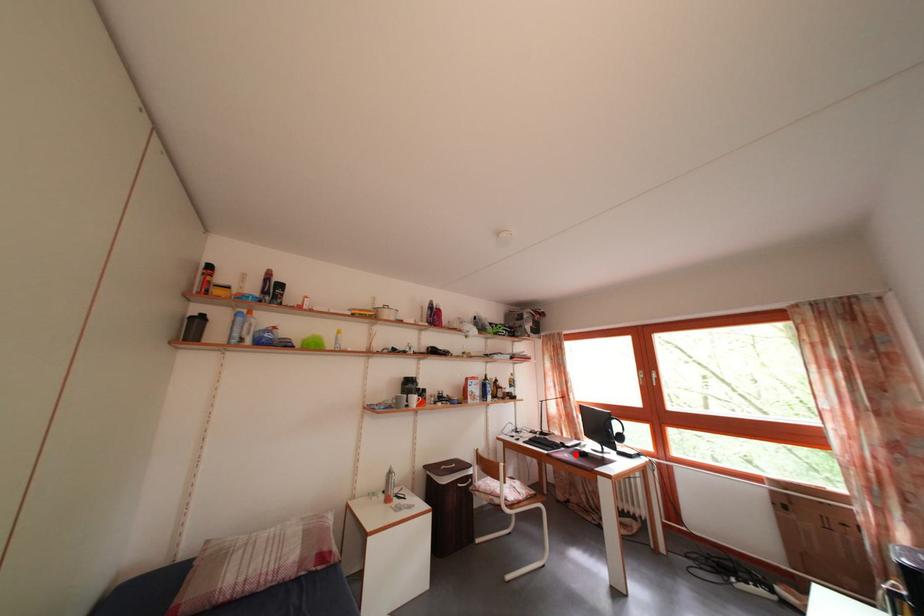
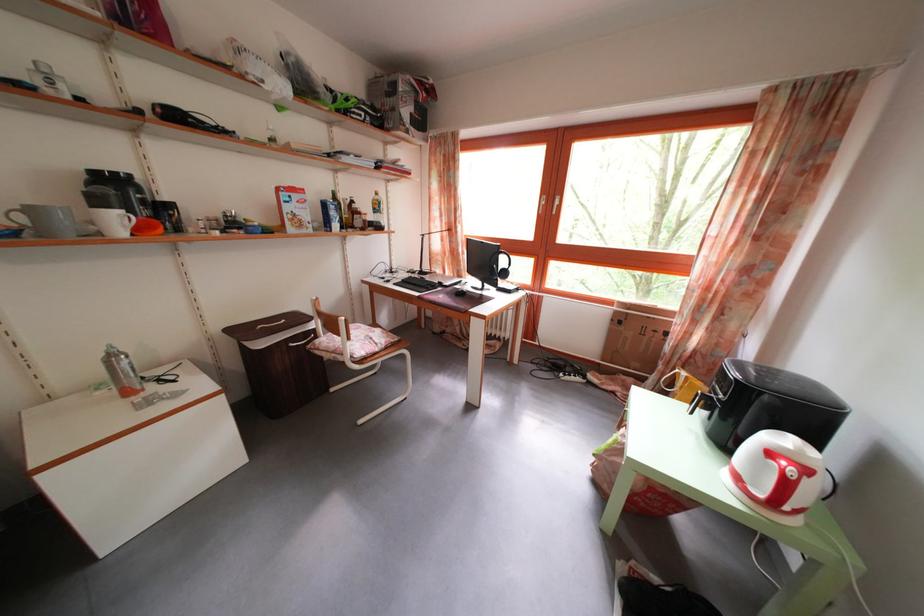
The point at the highlighted location is marked in the first image. Where is the corresponding point in the second image?

(454, 294)